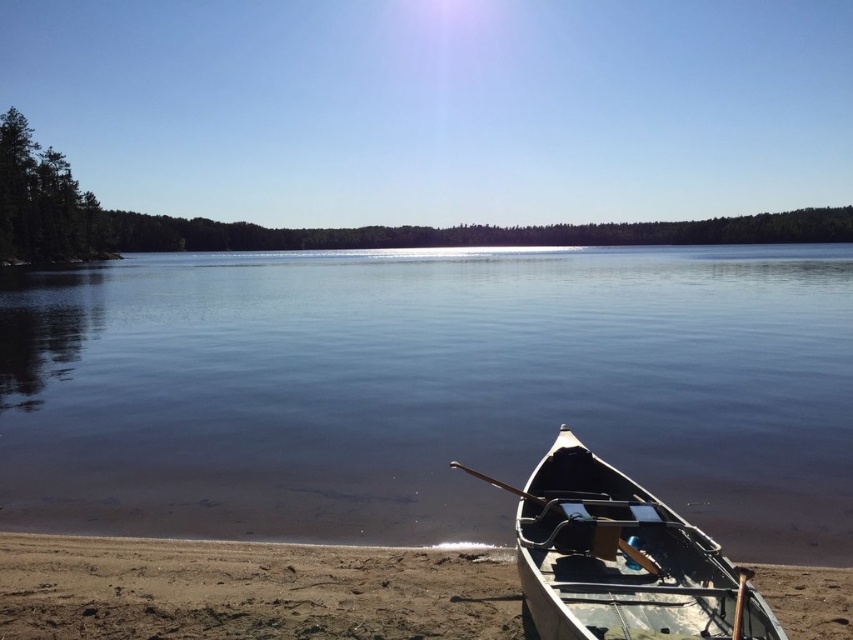
Does clear water at center have a lesser width compared to light gray wooden canoe at lower right?

Incorrect, clear water at center's width is not less than light gray wooden canoe at lower right's.

Find the location of a particular element. clear water at center is located at coordinates (428, 390).

This screenshot has height=640, width=853. What are the coordinates of `clear water at center` in the screenshot? It's located at (428, 390).

Between brown sandy beach at lower right and light gray wooden canoe at lower right, which one has more height?

With more height is light gray wooden canoe at lower right.

Who is more distant from viewer, (305, 554) or (608, 577)?

The point (305, 554) is more distant.

What do you see at coordinates (248, 589) in the screenshot?
I see `brown sandy beach at lower right` at bounding box center [248, 589].

The width and height of the screenshot is (853, 640). Find the location of `brown sandy beach at lower right`. brown sandy beach at lower right is located at coordinates (248, 589).

Which is more to the right, clear water at center or brown sandy beach at lower right?

From the viewer's perspective, brown sandy beach at lower right appears more on the right side.

Is point (651, 323) closer to viewer compared to point (277, 625)?

No.

Does point (479, 256) come in front of point (296, 576)?

No, it is not.

Where is `clear water at center`? The width and height of the screenshot is (853, 640). clear water at center is located at coordinates (428, 390).